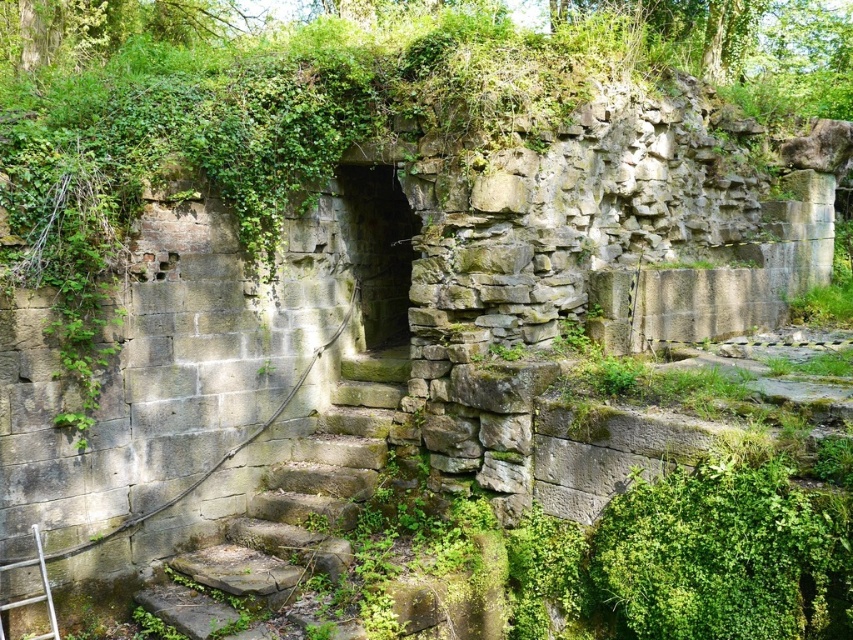
You are standing at the entrance of the old stone structure and notice the stone steps at center. Based on their position, can you determine if they lead towards the archway or away from it?

The stone steps at center is located at point (306, 493), which is in the central area of the structure. Since the archway is a central feature leading into the interior, the steps likely lead towards the archway.